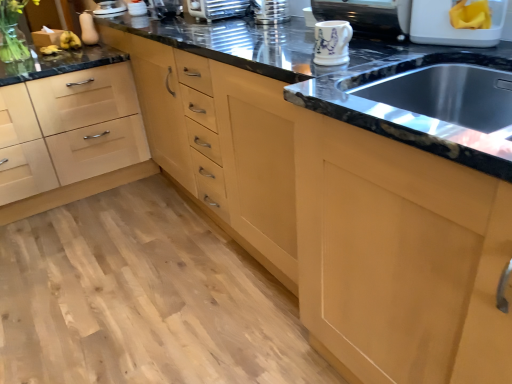
Question: In the image, is white glossy mug at upper center, which is the 2th appliance in right-to-left order, on the left side or the right side of clear glass vase at upper left?

Choices:
 (A) right
 (B) left

Answer: (A)

Question: Is point (386, 11) closer or farther from the camera than point (16, 1)?

Choices:
 (A) closer
 (B) farther

Answer: (A)

Question: Which object is the farthest from the white glossy toaster at upper center, arranged as the 2th appliance when viewed from the left?

Choices:
 (A) light wood drawer at lower left
 (B) metallic silver toaster at upper center, the 6th appliance in the right-to-left sequence
 (C) metallic silver toaster at upper center, placed as the 4th appliance when sorted from left to right
 (D) matte white squash at upper left, the eighth appliance in the right-to-left sequence
 (E) white glossy mug at upper center, which is the 2th appliance in right-to-left order

Answer: (E)

Question: Estimate the real-world distances between objects in this image. Which object is farther from the metallic silver toaster at upper center, placed as the 4th appliance when sorted from left to right?

Choices:
 (A) matte white squash at upper left, the eighth appliance in the right-to-left sequence
 (B) light wood drawer at lower left
 (C) metallic silver toaster at upper center, the 4th appliance when ordered from right to left
 (D) black granite sink at center
 (E) white plastic container at upper right, which is counted as the eighth appliance, starting from the left

Answer: (D)